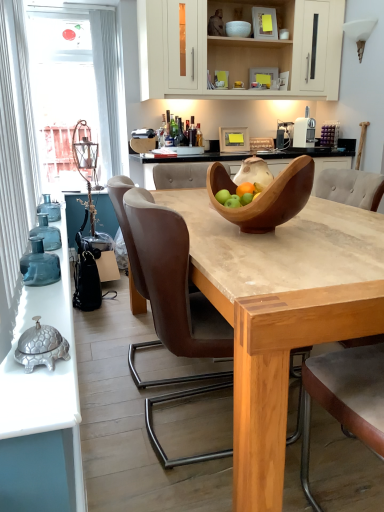
Locate an element on the screen. The height and width of the screenshot is (512, 384). blank space above transparent glass window at upper left (from a real-world perspective) is located at coordinates (60, 0).